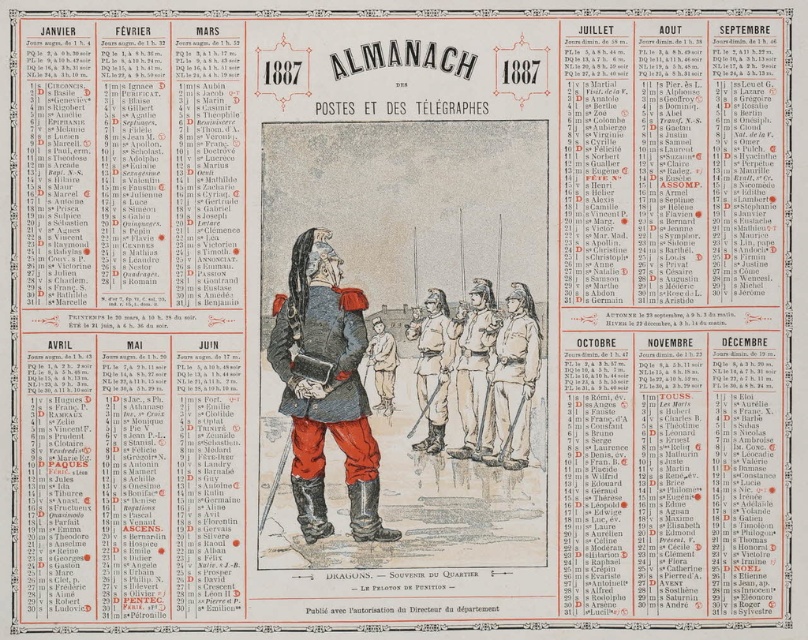
From the picture: Is light brown leather uniform at center further to the viewer compared to brown leather boots at center?

Yes.

Does point (512, 384) come closer to viewer compared to point (434, 368)?

Yes, point (512, 384) is closer to viewer.

This screenshot has height=640, width=808. What are the coordinates of `light brown leather uniform at center` in the screenshot? It's located at (514, 378).

Is light brown leather uniform at center taller than light brown leather boots at center?

Yes.

Which is in front, point (501, 420) or point (489, 428)?

Positioned in front is point (489, 428).

Between point (507, 333) and point (485, 285), which one is positioned in front?

Point (507, 333) is more forward.

The image size is (808, 640). I want to click on light brown leather uniform at center, so click(x=514, y=378).

How far apart are smooth blue coat at center and brown leather boots at center?

The distance of smooth blue coat at center from brown leather boots at center is 4.90 meters.

Is smooth blue coat at center taller than brown leather boots at center?

No.

Which is in front, point (297, 488) or point (448, 384)?

Point (297, 488) is more forward.

This screenshot has height=640, width=808. I want to click on smooth blue coat at center, so click(325, 387).